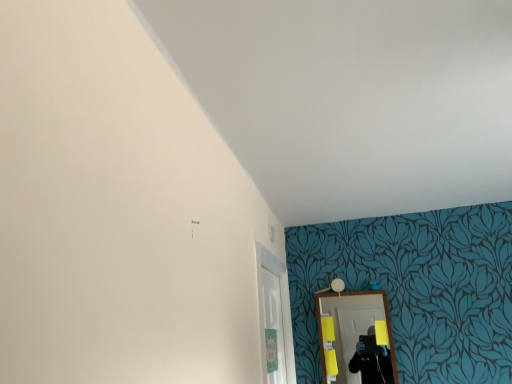
What do you see at coordinates (352, 327) in the screenshot?
I see `matte black mirror at lower right` at bounding box center [352, 327].

Measure the distance between matte black mirror at lower right and camera.

matte black mirror at lower right and camera are 2.31 meters apart from each other.

You are a GUI agent. You are given a task and a screenshot of the screen. Output one action in this format:
    pyautogui.click(x=<x>, y=<y>)
    Task: Click on the matte black mirror at lower right
    This screenshot has width=512, height=384.
    Given the screenshot: What is the action you would take?
    pyautogui.click(x=352, y=327)

This screenshot has height=384, width=512. Identify the location of matte black mirror at lower right. (352, 327).